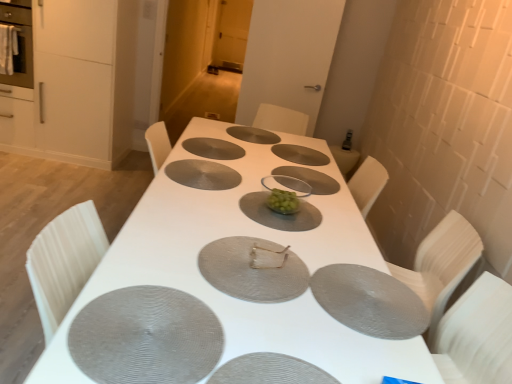
Identify the location of vacant space that is in between gray textured placemat at center, the 5th pizza pan in the front-to-back sequence, and green matte platter at center. (229, 188).